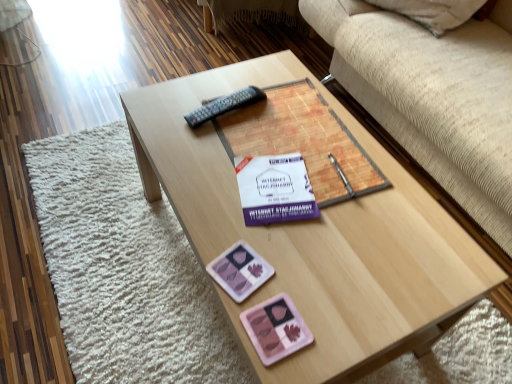
At what (x,y) coordinates should I click in order to perform the action: click on vacant region above white paper at center (from a real-world perspective). Please return your answer as a coordinate pair (x, y). This screenshot has height=384, width=512. Looking at the image, I should click on (274, 188).